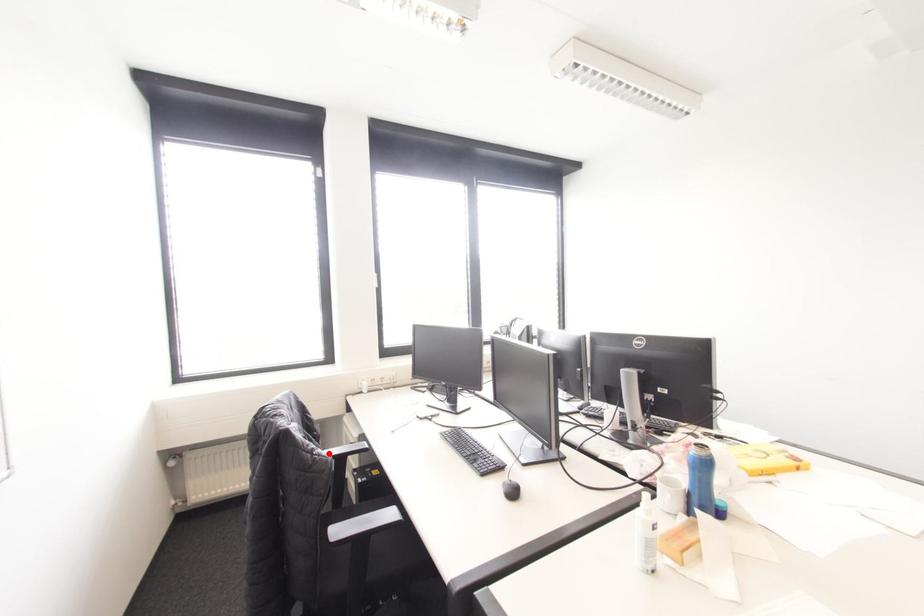
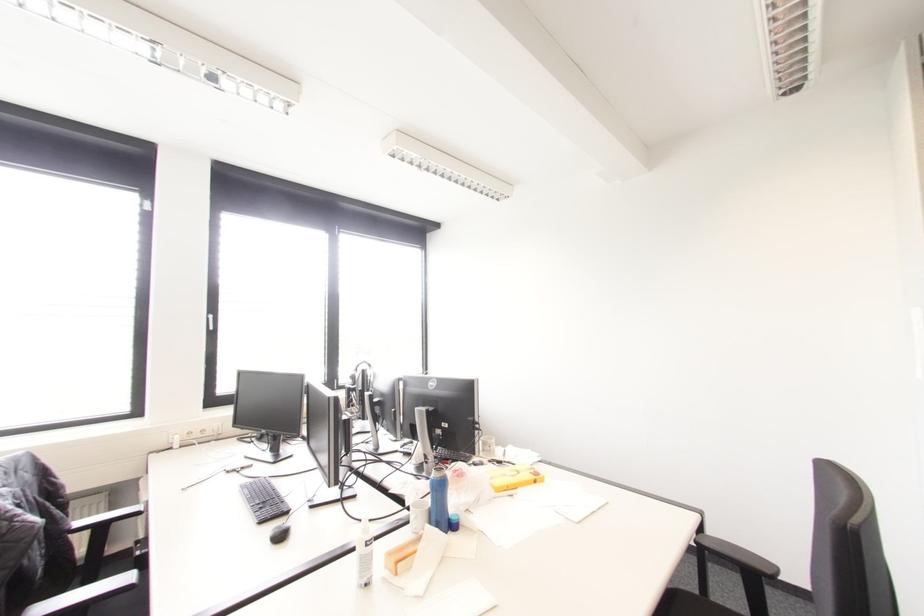
In the second image, find the point that corresponds to the highlighted location in the first image.

(79, 523)